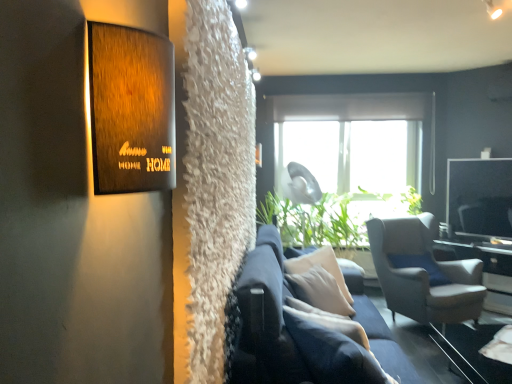
In order to face navy blue fabric couch at center, should I rotate leftwards or rightwards?

To align with it, rotate right about 11.551°.

Find the location of a particular element. The image size is (512, 384). navy blue fabric couch at center is located at coordinates 289,330.

Locate an element on the screen. white glossy table at right is located at coordinates (x=487, y=269).

Locate an element on the screen. navy blue fabric couch at center is located at coordinates (289, 330).

Which point is more forward, (x=321, y=368) or (x=503, y=251)?

Point (x=321, y=368)

Is navy blue fabric couch at center oriented towards white glossy table at right?

Yes, navy blue fabric couch at center faces towards white glossy table at right.

Is navy blue fabric couch at center thinner than white glossy table at right?

In fact, navy blue fabric couch at center might be wider than white glossy table at right.

Is navy blue fabric couch at center further to camera compared to white glossy table at right?

No, navy blue fabric couch at center is closer to the viewer.

From the image's perspective, is navy blue fabric couch at center on transparent glass table at lower right?

Yes, from the image's perspective, navy blue fabric couch at center is on top of transparent glass table at lower right.

Is transparent glass table at lower right inside navy blue fabric couch at center?

Actually, transparent glass table at lower right is outside navy blue fabric couch at center.

In the scene shown: Considering the sizes of navy blue fabric couch at center and transparent glass table at lower right in the image, is navy blue fabric couch at center bigger or smaller than transparent glass table at lower right?

navy blue fabric couch at center is bigger than transparent glass table at lower right.

Is white glossy table at right closer to camera compared to matte gray fabric armchair at right?

That is False.

Is white glossy table at right completely or partially outside of matte gray fabric armchair at right?

Yes, white glossy table at right is outside of matte gray fabric armchair at right.

From a real-world perspective, is white glossy table at right located beneath matte gray fabric armchair at right?

Yes, from a real-world perspective, white glossy table at right is beneath matte gray fabric armchair at right.

From a real-world perspective, is white glossy table at right beneath transparent glass table at lower right?

Actually, white glossy table at right is physically above transparent glass table at lower right in the real world.

Is white glossy table at right far away from transparent glass table at lower right?

Yes, white glossy table at right and transparent glass table at lower right are located far from each other.

Choose the correct answer: Is white glossy table at right inside transparent glass table at lower right or outside it?

white glossy table at right is not inside transparent glass table at lower right, it's outside.

Which object is more forward, white glossy table at right or transparent glass table at lower right?

transparent glass table at lower right.

Is there a large distance between matte gray fabric armchair at right and transparent glass table at lower right?

No.

Considering the relative sizes of matte gray fabric armchair at right and transparent glass table at lower right in the image provided, is matte gray fabric armchair at right smaller than transparent glass table at lower right?

Incorrect, matte gray fabric armchair at right is not smaller in size than transparent glass table at lower right.

Looking at this image, from the image's perspective, is matte gray fabric armchair at right positioned above or below transparent glass table at lower right?

Based on their image positions, matte gray fabric armchair at right is located above transparent glass table at lower right.

Is transparent glass table at lower right positioned with its back to matte gray fabric armchair at right?

Yes, transparent glass table at lower right is positioned with its back facing matte gray fabric armchair at right.

Considering the points (464, 332) and (472, 317), which point is in front, point (464, 332) or point (472, 317)?

The point (464, 332) is closer to the camera.

Consider the image. Who is shorter, transparent glass table at lower right or matte gray fabric armchair at right?

transparent glass table at lower right is shorter.

Choose the correct answer: Is transparent glass table at lower right inside matte gray fabric armchair at right or outside it?

transparent glass table at lower right is not enclosed by matte gray fabric armchair at right.

Is point (467, 369) farther from camera compared to point (492, 250)?

No.

Is white glossy table at right a part of transparent glass table at lower right?

Actually, white glossy table at right is outside transparent glass table at lower right.

From a real-world perspective, which is physically above, transparent glass table at lower right or white glossy table at right?

From a 3D spatial view, white glossy table at right is above.

I want to click on table on the right of the transparent glass table at lower right, so click(487, 269).

Locate an element on the screen. The width and height of the screenshot is (512, 384). studio couch on the left of white glossy table at right is located at coordinates (289, 330).

The width and height of the screenshot is (512, 384). Find the location of `studio couch lying above the transparent glass table at lower right (from the image's perspective)`. studio couch lying above the transparent glass table at lower right (from the image's perspective) is located at coordinates (289, 330).

From the image, which object appears to be farther from matte gray fabric armchair at right, transparent glass table at lower right or navy blue fabric couch at center?

navy blue fabric couch at center lies further to matte gray fabric armchair at right than the other object.

When comparing their distances from transparent glass table at lower right, does white glossy table at right or navy blue fabric couch at center seem closer?

Among the two, white glossy table at right is located nearer to transparent glass table at lower right.

Which object lies further to the anchor point navy blue fabric couch at center, transparent glass table at lower right or white glossy table at right?

white glossy table at right.

Estimate the real-world distances between objects in this image. Which object is closer to matte gray fabric armchair at right, transparent glass table at lower right or white glossy table at right?

Among the two, transparent glass table at lower right is located nearer to matte gray fabric armchair at right.

Which object lies further to the anchor point transparent glass table at lower right, matte gray fabric armchair at right or white glossy table at right?

Among the two, white glossy table at right is located further to transparent glass table at lower right.

Which object lies nearer to the anchor point navy blue fabric couch at center, white glossy table at right or matte gray fabric armchair at right?

matte gray fabric armchair at right lies closer to navy blue fabric couch at center than the other object.

From the image, which object appears to be nearer to white glossy table at right, matte gray fabric armchair at right or navy blue fabric couch at center?

matte gray fabric armchair at right lies closer to white glossy table at right than the other object.

From the image, which object appears to be nearer to transparent glass table at lower right, navy blue fabric couch at center or white glossy table at right?

Based on the image, white glossy table at right appears to be nearer to transparent glass table at lower right.

The width and height of the screenshot is (512, 384). Find the location of `glass table between navy blue fabric couch at center and white glossy table at right along the z-axis`. glass table between navy blue fabric couch at center and white glossy table at right along the z-axis is located at coordinates (471, 352).

I want to click on chair located between transparent glass table at lower right and white glossy table at right in the depth direction, so click(423, 273).

Locate an element on the screen. The height and width of the screenshot is (384, 512). glass table between navy blue fabric couch at center and matte gray fabric armchair at right from front to back is located at coordinates (471, 352).

Where is `chair between navy blue fabric couch at center and white glossy table at right from front to back`? This screenshot has width=512, height=384. chair between navy blue fabric couch at center and white glossy table at right from front to back is located at coordinates (423, 273).